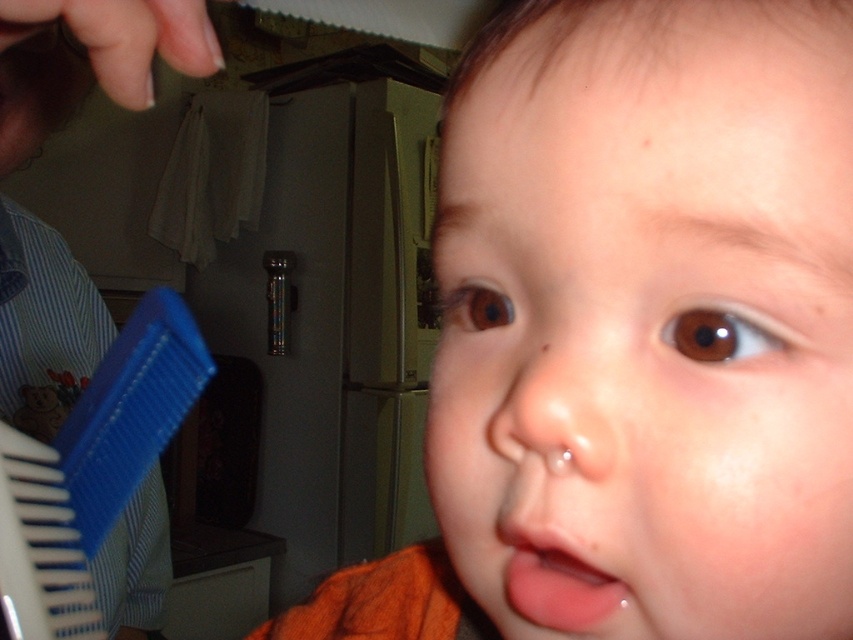
Is blue plastic comb at upper left further to camera compared to pink glossy lips at center?

Yes.

Can you confirm if blue plastic comb at upper left is positioned to the left of pink glossy lips at center?

Correct, you'll find blue plastic comb at upper left to the left of pink glossy lips at center.

Who is more forward, (115, 636) or (590, 586)?

Point (590, 586)

I want to click on blue plastic comb at upper left, so click(x=90, y=60).

Is point (610, 502) more distant than point (544, 589)?

No, (610, 502) is closer to viewer.

Find the location of a particular element. This screenshot has height=640, width=853. smooth skin baby at center is located at coordinates (637, 326).

Consider the image. Can you confirm if smooth skin baby at center is thinner than blue plastic comb at upper left?

Yes.

Does point (815, 298) lie behind point (6, 70)?

No, (815, 298) is in front of (6, 70).

What do you see at coordinates (637, 326) in the screenshot? The height and width of the screenshot is (640, 853). I see `smooth skin baby at center` at bounding box center [637, 326].

Where is `smooth skin baby at center`? smooth skin baby at center is located at coordinates (637, 326).